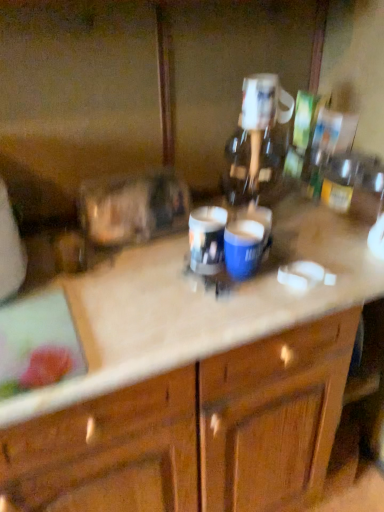
In order to click on vacant region to the left of matte plastic cup at center, which is counted as the 1th beverage, starting from the left in this screenshot , I will do `click(139, 270)`.